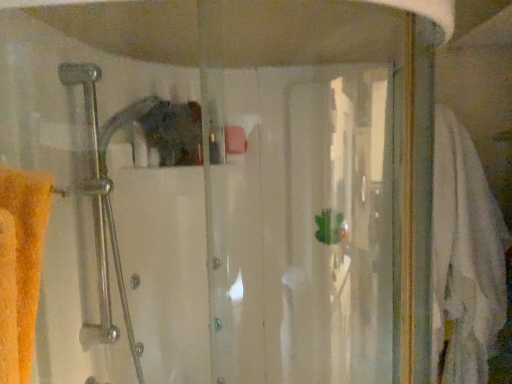
Image resolution: width=512 pixels, height=384 pixels. Describe the element at coordinates (464, 256) in the screenshot. I see `white soft towel at right` at that location.

Identify the location of white soft towel at right. pos(464,256).

This screenshot has height=384, width=512. What are the coordinates of `white soft towel at right` in the screenshot? It's located at (464, 256).